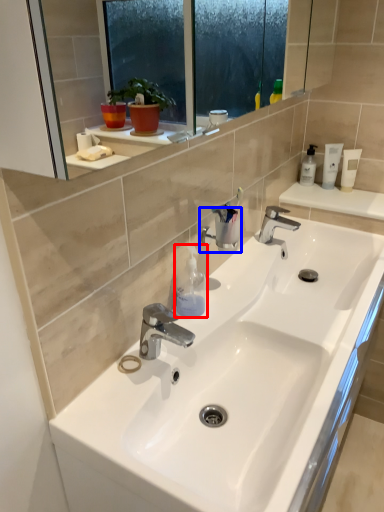
Question: Among these objects, which one is farthest to the camera, toiletry (highlighted by a red box) or plumbing fixture (highlighted by a blue box)?

Choices:
 (A) toiletry
 (B) plumbing fixture

Answer: (B)